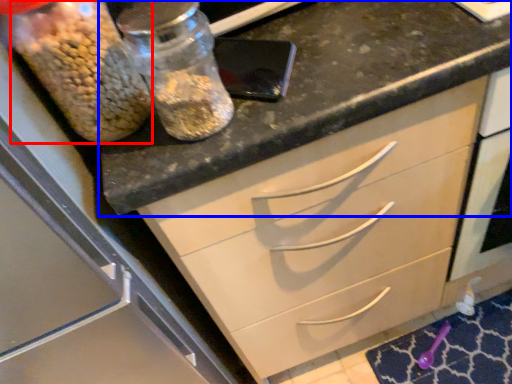
Question: Which point is further to the camera, food (highlighted by a red box) or countertop (highlighted by a blue box)?

Choices:
 (A) food
 (B) countertop

Answer: (B)